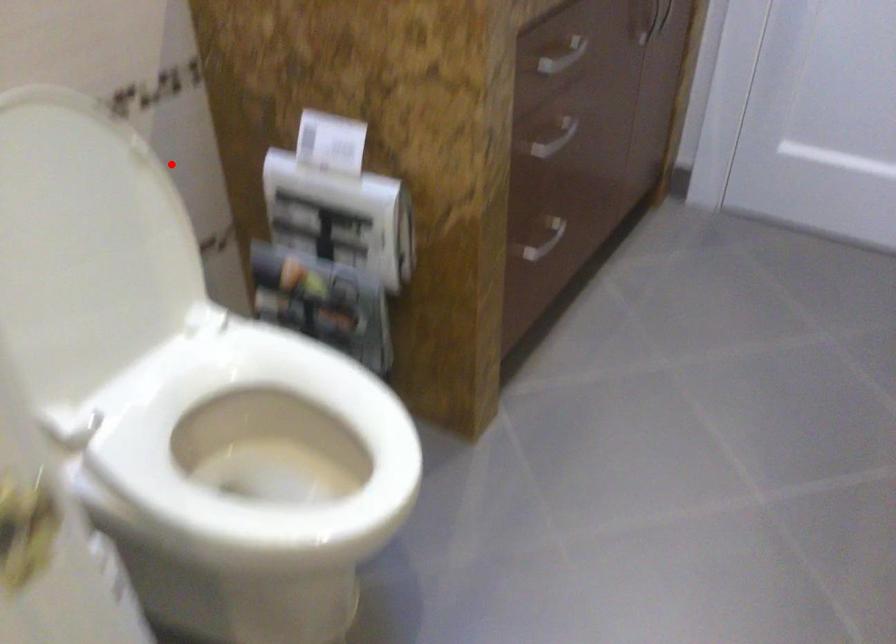
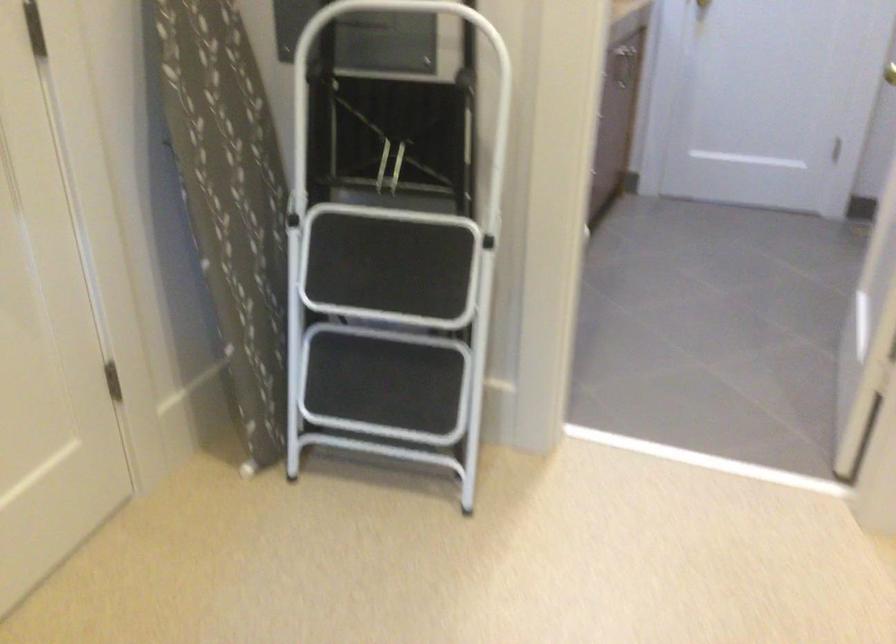
Question: I am providing you with two images of the same scene from different viewpoints. A red point is marked on the first image. Is the red point's position out of view in image 2?

Choices:
 (A) Yes
 (B) No

Answer: (A)